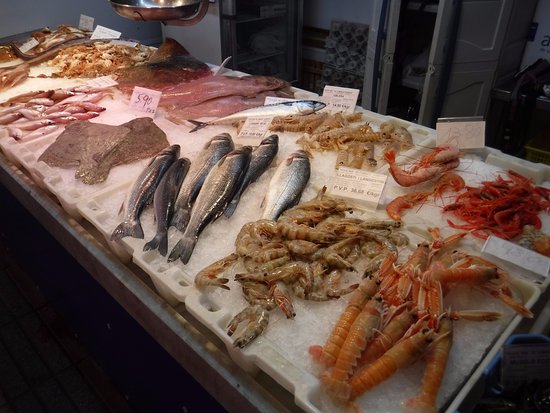
I want to click on black floor, so click(20, 219), click(20, 277), click(26, 385), click(52, 303), click(79, 351), click(142, 367).